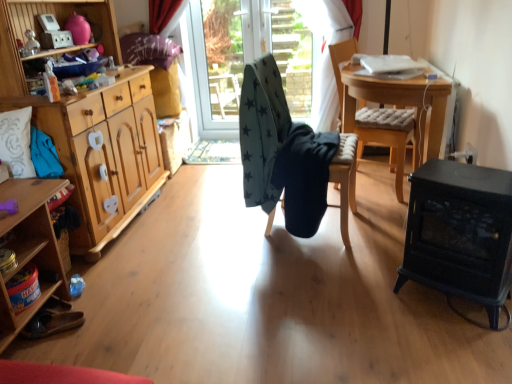
What are the coordinates of `empty space that is in between black cast iron fireplace at lower right and dark blue fabric at center, the second chair in the left-to-right sequence` in the screenshot? It's located at (366, 251).